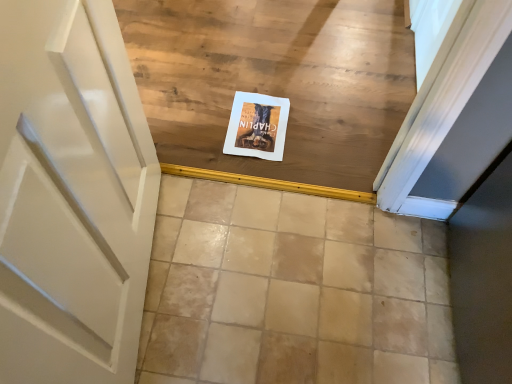
Question: From a real-world perspective, is beige ceramic tile at center beneath white paper at center?

Choices:
 (A) yes
 (B) no

Answer: (A)

Question: Does beige ceramic tile at center appear on the right side of white paper at center?

Choices:
 (A) yes
 (B) no

Answer: (A)

Question: Is beige ceramic tile at center touching white paper at center?

Choices:
 (A) no
 (B) yes

Answer: (A)

Question: Can you confirm if beige ceramic tile at center is shorter than white paper at center?

Choices:
 (A) yes
 (B) no

Answer: (B)

Question: Is beige ceramic tile at center not inside white paper at center?

Choices:
 (A) yes
 (B) no

Answer: (A)

Question: Does beige ceramic tile at center have a smaller size compared to white paper at center?

Choices:
 (A) no
 (B) yes

Answer: (A)

Question: From the image's perspective, is white paper at center located above beige ceramic tile at center?

Choices:
 (A) no
 (B) yes

Answer: (B)

Question: Can you confirm if white paper at center is shorter than beige ceramic tile at center?

Choices:
 (A) yes
 (B) no

Answer: (A)

Question: Can you see white paper at center touching beige ceramic tile at center?

Choices:
 (A) yes
 (B) no

Answer: (B)

Question: Is beige ceramic tile at center at the back of white paper at center?

Choices:
 (A) yes
 (B) no

Answer: (A)

Question: Considering the relative positions of white paper at center and beige ceramic tile at center in the image provided, is white paper at center to the right of beige ceramic tile at center from the viewer's perspective?

Choices:
 (A) yes
 (B) no

Answer: (B)

Question: From a real-world perspective, is white paper at center under beige ceramic tile at center?

Choices:
 (A) yes
 (B) no

Answer: (B)

Question: Is point (443, 258) closer or farther from the camera than point (227, 144)?

Choices:
 (A) closer
 (B) farther

Answer: (A)